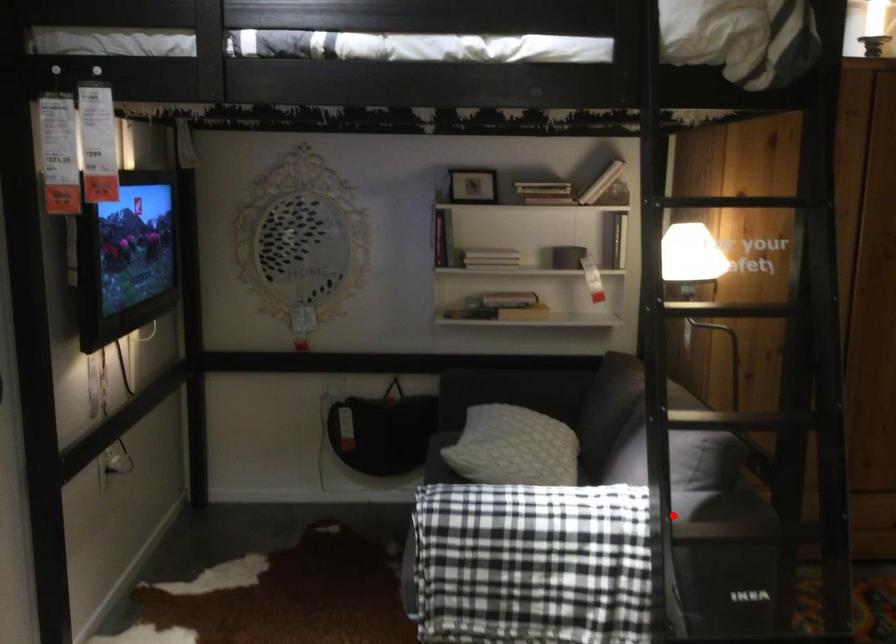
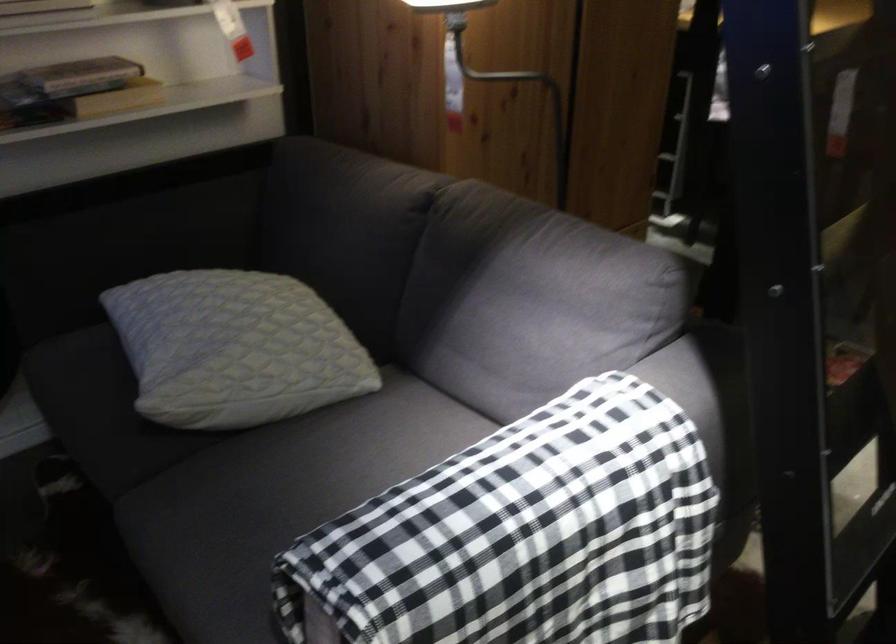
Question: I am providing you with two images of the same scene from different viewpoints. A red point is shown in image1. For the corresponding object point in image2, is it positioned nearer or farther from the camera?

Choices:
 (A) Nearer
 (B) Farther

Answer: (A)